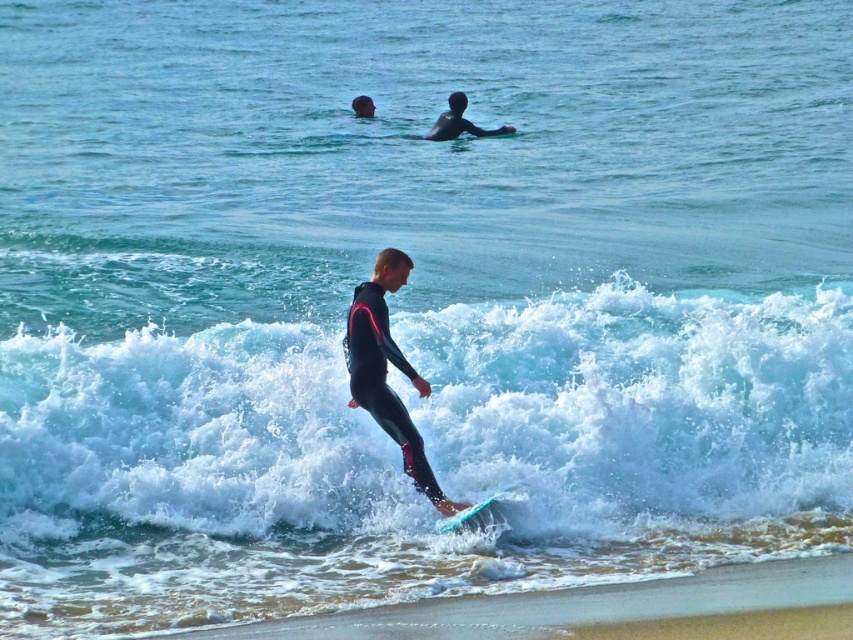
Does white foamy wave at center appear on the left side of black matte wetsuit at center?

Yes, white foamy wave at center is to the left of black matte wetsuit at center.

Image resolution: width=853 pixels, height=640 pixels. Identify the location of white foamy wave at center. (643, 410).

Locate an element on the screen. Image resolution: width=853 pixels, height=640 pixels. white foamy wave at center is located at coordinates (643, 410).

What do you see at coordinates (482, 515) in the screenshot? I see `translucent blue surfboard at lower center` at bounding box center [482, 515].

Looking at this image, who is more distant from viewer, (482,502) or (456,97)?

Positioned behind is point (456,97).

Which is behind, point (480, 513) or point (497, 132)?

Positioned behind is point (497, 132).

Identify the location of translucent blue surfboard at lower center. (482, 515).

Measure the distance from smooth sand at lower center to translucent blue surfboard at lower center.

1.50 meters

Which is in front, point (508, 611) or point (511, 524)?

Positioned in front is point (508, 611).

Locate an element on the screen. smooth sand at lower center is located at coordinates (572, 605).